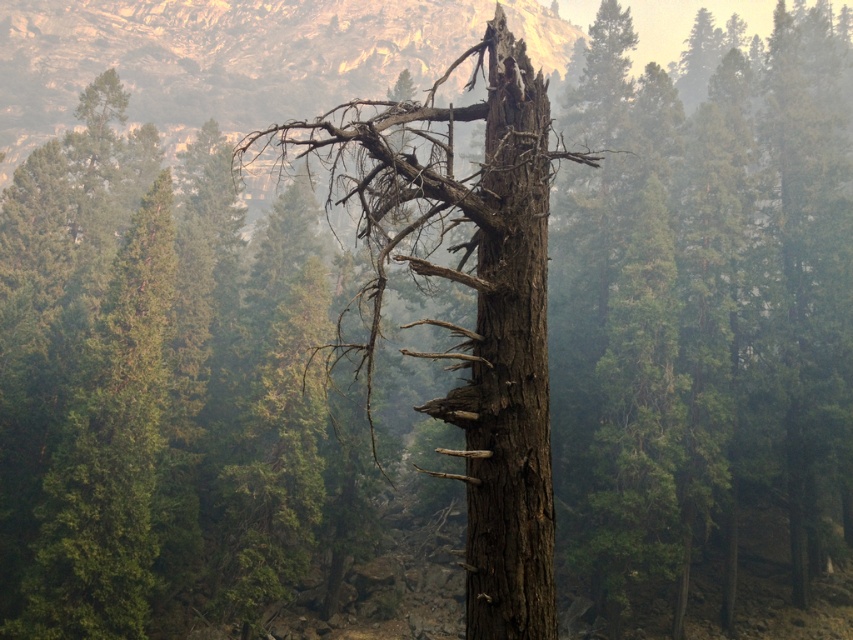
Question: Is brown rough bark tree at center below dark brown rough bark tree trunk at center?

Choices:
 (A) yes
 (B) no

Answer: (B)

Question: Which point appears farthest from the camera in this image?

Choices:
 (A) (553, 637)
 (B) (526, 508)

Answer: (A)

Question: Is brown rough bark tree at center to the right of dark brown rough bark tree trunk at center from the viewer's perspective?

Choices:
 (A) no
 (B) yes

Answer: (A)

Question: Is brown rough bark tree at center positioned before dark brown rough bark tree trunk at center?

Choices:
 (A) no
 (B) yes

Answer: (B)